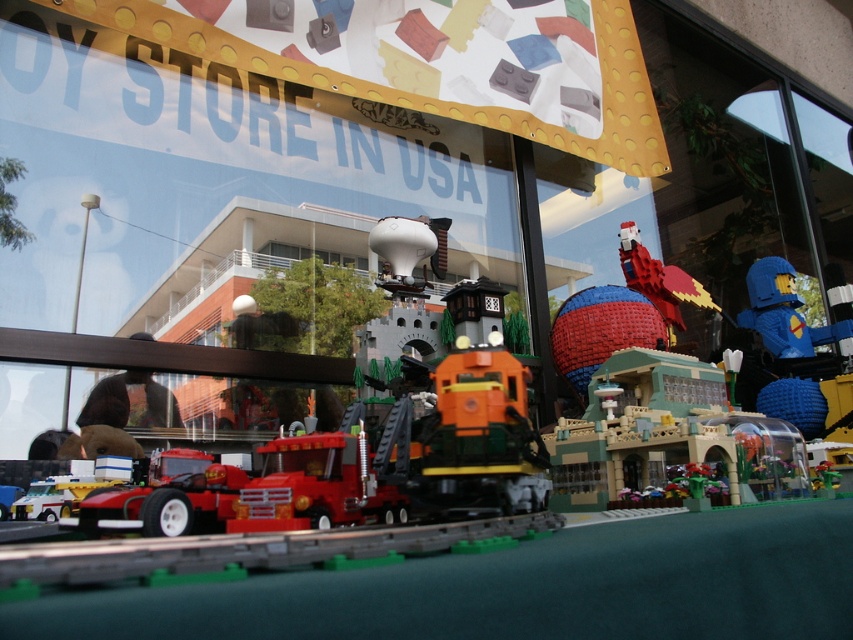
You are standing in the toy store and want to find the matte red truck at center. According to the coordinates provided, where should you look in the image?

The matte red truck at center is located at the coordinates point (262, 493) in the image.

You are a customer looking at the LEGO display in the toy store. You notice a brick red bird at upper right and a clear glass window at center. Which object is taller?

The brick red bird at upper right is taller than the clear glass window at center.

You are a customer in the toy store looking at the LEGO display. You notice the matte red truck at center and the brick red bird at upper right. Which of these two LEGO sets is larger in size?

The brick red bird at upper right is larger in size compared to the matte red truck at center.